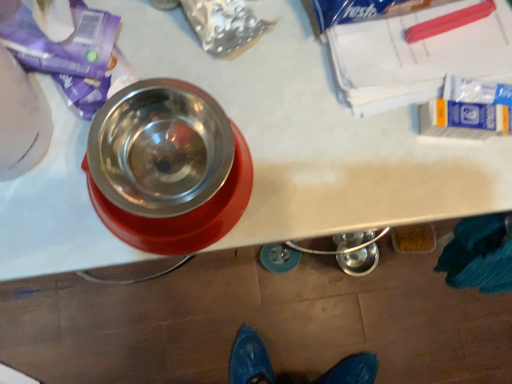
What do you see at coordinates (414, 238) in the screenshot? The width and height of the screenshot is (512, 384). I see `translucent plastic container at lower right` at bounding box center [414, 238].

Locate an element on the screen. translucent plastic container at lower right is located at coordinates (414, 238).

What do you see at coordinates (167, 167) in the screenshot? I see `metallic stainless steel bowl at upper left` at bounding box center [167, 167].

Find the location of `metallic stainless steel bowl at upper left`. metallic stainless steel bowl at upper left is located at coordinates (167, 167).

In order to face metallic stainless steel bowl at upper left, should I rotate leftwards or rightwards?

Turn left approximately 12.186 degrees to face it.

Measure the distance between point (97, 123) and camera.

The distance of point (97, 123) from camera is 15.67 inches.

The height and width of the screenshot is (384, 512). Find the location of `translucent plastic container at lower right`. translucent plastic container at lower right is located at coordinates (414, 238).

Is translucent plastic container at lower right at the right side of metallic stainless steel bowl at upper left?

Yes.

In the image, is translucent plastic container at lower right positioned in front of or behind metallic stainless steel bowl at upper left?

In the image, translucent plastic container at lower right appears behind metallic stainless steel bowl at upper left.

Is point (401, 251) closer or farther from the camera than point (133, 113)?

Point (401, 251) appears to be farther away from the viewer than point (133, 113).

From the image's perspective, is translucent plastic container at lower right below metallic stainless steel bowl at upper left?

Yes, from the image's perspective, translucent plastic container at lower right is below metallic stainless steel bowl at upper left.

Based on the photo, from a real-world perspective, is translucent plastic container at lower right positioned above or below metallic stainless steel bowl at upper left?

Clearly, from a real-world perspective, translucent plastic container at lower right is below metallic stainless steel bowl at upper left.

Which of these two, translucent plastic container at lower right or metallic stainless steel bowl at upper left, is thinner?

Thinner between the two is translucent plastic container at lower right.

Between translucent plastic container at lower right and metallic stainless steel bowl at upper left, which one has more height?

With more height is metallic stainless steel bowl at upper left.

Can you confirm if translucent plastic container at lower right is smaller than metallic stainless steel bowl at upper left?

Correct, translucent plastic container at lower right occupies less space than metallic stainless steel bowl at upper left.

Would you say translucent plastic container at lower right is outside metallic stainless steel bowl at upper left?

That's correct, translucent plastic container at lower right is outside of metallic stainless steel bowl at upper left.

Is translucent plastic container at lower right beside metallic stainless steel bowl at upper left?

translucent plastic container at lower right and metallic stainless steel bowl at upper left are not in contact.

Is translucent plastic container at lower right looking in the opposite direction of metallic stainless steel bowl at upper left?

No, translucent plastic container at lower right's orientation is not away from metallic stainless steel bowl at upper left.

In the image, there is a translucent plastic container at lower right. Where is `tableware above it (from the image's perspective)`? This screenshot has height=384, width=512. tableware above it (from the image's perspective) is located at coordinates (167, 167).

Is metallic stainless steel bowl at upper left at the right side of translucent plastic container at lower right?

No, metallic stainless steel bowl at upper left is not to the right of translucent plastic container at lower right.

Who is more distant, metallic stainless steel bowl at upper left or translucent plastic container at lower right?

translucent plastic container at lower right is further away from the camera.

Is point (207, 142) closer or farther from the camera than point (425, 229)?

Point (207, 142) is positioned closer to the camera compared to point (425, 229).

From the image's perspective, which object appears higher, metallic stainless steel bowl at upper left or translucent plastic container at lower right?

metallic stainless steel bowl at upper left is shown above in the image.

Based on the photo, from a real-world perspective, who is located lower, metallic stainless steel bowl at upper left or translucent plastic container at lower right?

In real-world perspective, translucent plastic container at lower right is lower.

Looking at their sizes, would you say metallic stainless steel bowl at upper left is wider or thinner than translucent plastic container at lower right?

Considering their sizes, metallic stainless steel bowl at upper left looks broader than translucent plastic container at lower right.

Can you confirm if metallic stainless steel bowl at upper left is shorter than translucent plastic container at lower right?

No.

Can you confirm if metallic stainless steel bowl at upper left is smaller than translucent plastic container at lower right?

No.

Looking at this image, is translucent plastic container at lower right a part of metallic stainless steel bowl at upper left?

Actually, translucent plastic container at lower right is outside metallic stainless steel bowl at upper left.

Consider the image. Is there a large distance between metallic stainless steel bowl at upper left and translucent plastic container at lower right?

metallic stainless steel bowl at upper left is actually quite close to translucent plastic container at lower right.

Looking at this image, is metallic stainless steel bowl at upper left positioned with its back to translucent plastic container at lower right?

That's not correct — metallic stainless steel bowl at upper left is not looking away from translucent plastic container at lower right.

You are a GUI agent. You are given a task and a screenshot of the screen. Output one action in this format:
    pyautogui.click(x=<x>, y=<y>)
    Task: Click on the tableware above the translucent plastic container at lower right (from the image's perspective)
    This screenshot has height=384, width=512.
    Given the screenshot: What is the action you would take?
    pyautogui.click(x=167, y=167)

The height and width of the screenshot is (384, 512). Find the location of `tableware in front of the translucent plastic container at lower right`. tableware in front of the translucent plastic container at lower right is located at coordinates (167, 167).

The height and width of the screenshot is (384, 512). Identify the location of debris below the metallic stainless steel bowl at upper left (from a real-world perspective). (414, 238).